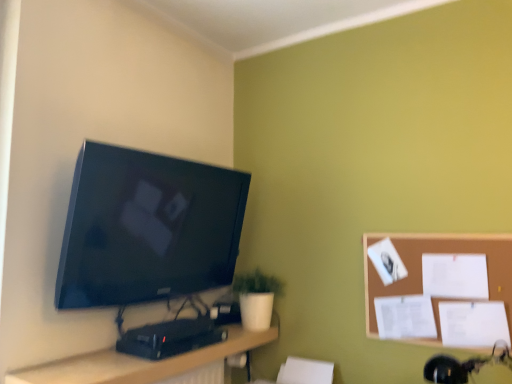
Question: From a real-world perspective, is brown corkboard at right beneath white matte pot at lower center?

Choices:
 (A) yes
 (B) no

Answer: (B)

Question: Is brown corkboard at right bigger than white matte pot at lower center?

Choices:
 (A) no
 (B) yes

Answer: (A)

Question: Is brown corkboard at right thinner than white matte pot at lower center?

Choices:
 (A) yes
 (B) no

Answer: (A)

Question: Considering the relative sizes of brown corkboard at right and white matte pot at lower center in the image provided, is brown corkboard at right shorter than white matte pot at lower center?

Choices:
 (A) yes
 (B) no

Answer: (B)

Question: Can you confirm if brown corkboard at right is taller than white matte pot at lower center?

Choices:
 (A) no
 (B) yes

Answer: (B)

Question: Looking at the image, does brown corkboard at right seem bigger or smaller compared to matte black tv at upper left?

Choices:
 (A) small
 (B) big

Answer: (A)

Question: Is brown corkboard at right wider or thinner than matte black tv at upper left?

Choices:
 (A) thin
 (B) wide

Answer: (A)

Question: Is point (453, 235) positioned closer to the camera than point (240, 205)?

Choices:
 (A) closer
 (B) farther

Answer: (A)

Question: Is brown corkboard at right inside the boundaries of matte black tv at upper left, or outside?

Choices:
 (A) inside
 (B) outside

Answer: (B)

Question: Does point (496, 233) appear closer or farther from the camera than point (261, 311)?

Choices:
 (A) farther
 (B) closer

Answer: (B)

Question: From a real-world perspective, is brown corkboard at right positioned above or below white matte pot at lower center?

Choices:
 (A) below
 (B) above

Answer: (B)

Question: From their relative heights in the image, would you say brown corkboard at right is taller or shorter than white matte pot at lower center?

Choices:
 (A) short
 (B) tall

Answer: (B)

Question: Based on their sizes in the image, would you say brown corkboard at right is bigger or smaller than white matte pot at lower center?

Choices:
 (A) small
 (B) big

Answer: (A)

Question: Considering their positions, is wooden desk at lower center located in front of or behind white matte pot at lower center?

Choices:
 (A) behind
 (B) front

Answer: (B)

Question: From the image's perspective, is wooden desk at lower center located above or below white matte pot at lower center?

Choices:
 (A) above
 (B) below

Answer: (B)